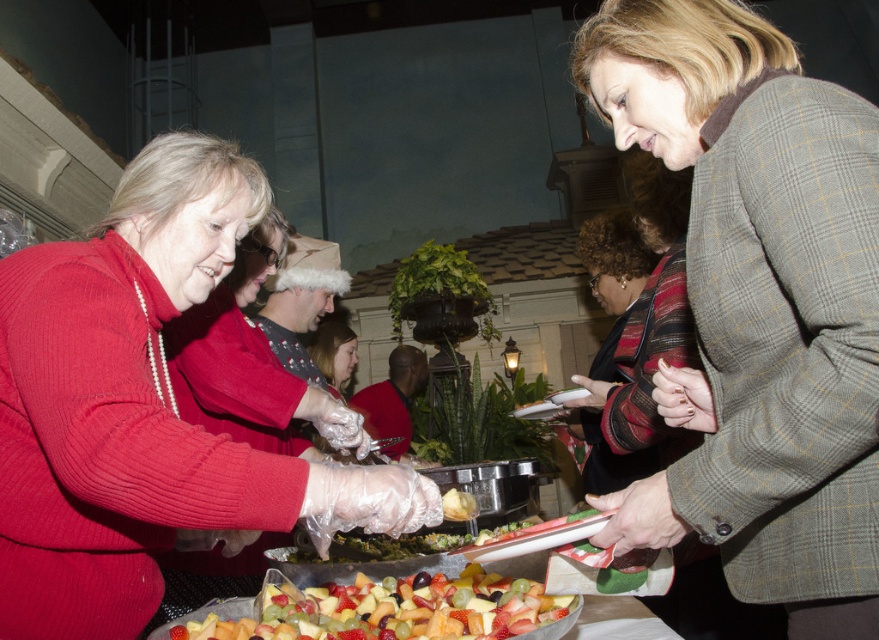
Is matte red sweater at lower left further to camera compared to glossy plastic fruit at center?

Yes, matte red sweater at lower left is further from the viewer.

Who is lower down, matte red sweater at lower left or glossy plastic fruit at center?

glossy plastic fruit at center

Between point (91, 419) and point (492, 614), which one is positioned behind?

Positioned behind is point (492, 614).

Locate an element on the screen. The width and height of the screenshot is (879, 640). matte red sweater at lower left is located at coordinates (140, 406).

Which is in front, point (870, 380) or point (26, 584)?

Point (870, 380) is in front.

Does plaid wool coat at center have a larger size compared to matte red sweater at lower left?

No, plaid wool coat at center is not bigger than matte red sweater at lower left.

The image size is (879, 640). What do you see at coordinates (758, 305) in the screenshot?
I see `plaid wool coat at center` at bounding box center [758, 305].

Where is `plaid wool coat at center`? This screenshot has height=640, width=879. plaid wool coat at center is located at coordinates (758, 305).

Does plaid wool coat at center have a larger size compared to glossy plastic fruit at center?

Yes, plaid wool coat at center is bigger than glossy plastic fruit at center.

Between point (844, 333) and point (384, 625), which one is positioned in front?

Positioned in front is point (844, 333).

You are a GUI agent. You are given a task and a screenshot of the screen. Output one action in this format:
    pyautogui.click(x=<x>, y=<y>)
    Task: Click on the plaid wool coat at center
    This screenshot has width=879, height=640.
    Given the screenshot: What is the action you would take?
    758,305